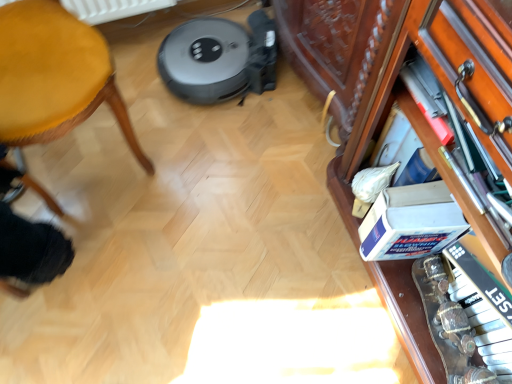
Identify the location of free point in front of yellow fabric stool at left. (123, 278).